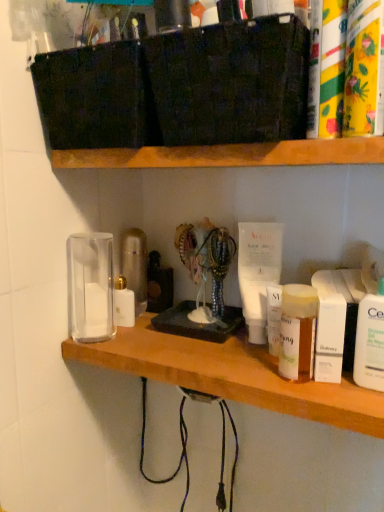
Identify the location of free spot to the left of white matte box at right, which appears as the 4th toiletry when viewed from the front. (222, 362).